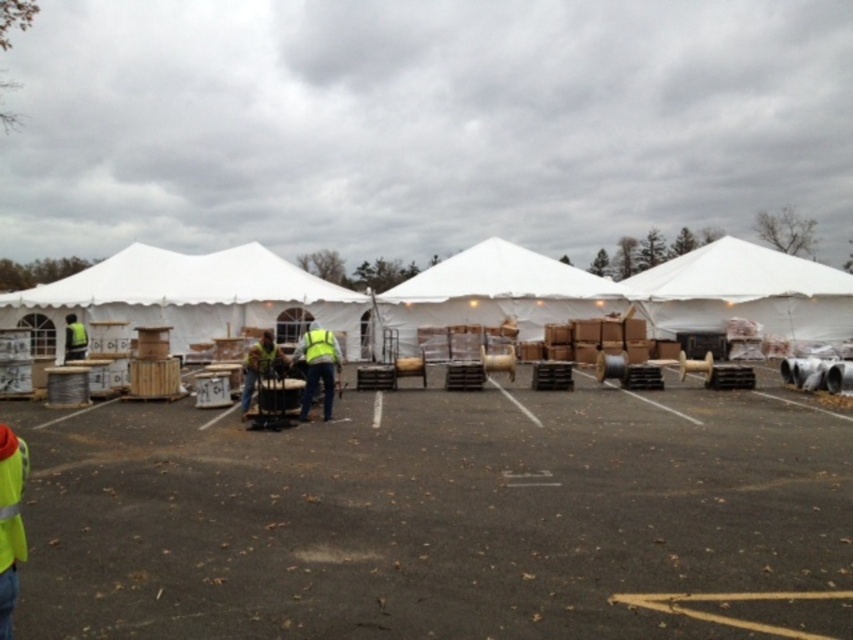
You are setting up an event and need to place a 1.5 meter wide equipment next to the yellow reflective vest at center. Can the white fabric canopy at left accommodate the equipment in terms of width?

The white fabric canopy at left has a larger width than the yellow reflective vest at center. Since the equipment is 1.5 meters wide, it can be placed under the white fabric canopy at left as it has sufficient width to accommodate the equipment.

You are navigating through the parking lot and need to reach the point at coordinates (68,326). There is an obstacle at point (311,339). Will you have to go around the obstacle to reach your destination?

Yes, you will have to go around the obstacle at point (311,339) because it is in front of your destination point (68,326), blocking the direct path.

You are a pedestrian walking across a parking lot with two reflective yellow vests in view. You see a reflective yellow vest at center and a reflective yellow vest at left. Which one is higher up in your field of view?

The reflective yellow vest at center is located above the reflective yellow vest at left, so it is higher up in your field of view.